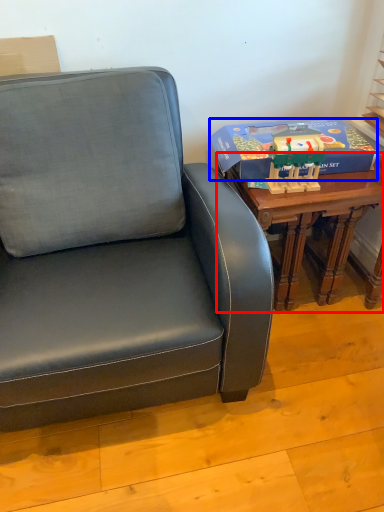
Question: Which object appears closest to the camera in this image, table (highlighted by a red box) or box (highlighted by a blue box)?

Choices:
 (A) table
 (B) box

Answer: (A)